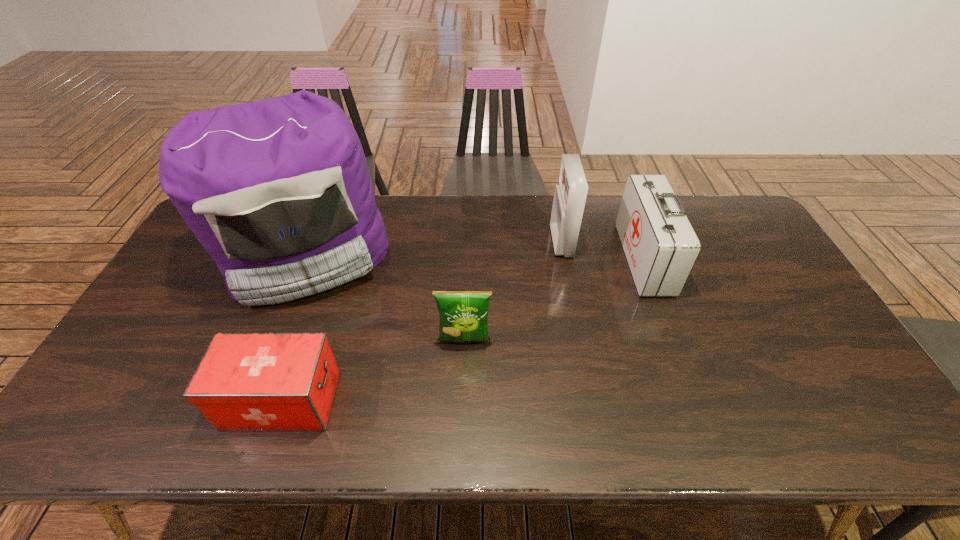
Image resolution: width=960 pixels, height=540 pixels. What are the coordinates of `vacant space located 0.080m on the front-facing side of the second tallest object` in the screenshot? It's located at (528, 242).

Where is `vacant space located on the front-facing side of the second tallest object`? This screenshot has width=960, height=540. vacant space located on the front-facing side of the second tallest object is located at coordinates [448, 242].

This screenshot has height=540, width=960. In order to click on free region located 0.170m on the front-facing side of the second tallest object in this screenshot , I will do `click(500, 242)`.

Where is `vacant area situated 0.300m on the front-facing side of the rightmost object`? This screenshot has height=540, width=960. vacant area situated 0.300m on the front-facing side of the rightmost object is located at coordinates (531, 259).

This screenshot has height=540, width=960. I want to click on vacant space situated on the front-facing side of the rightmost object, so click(x=502, y=259).

The height and width of the screenshot is (540, 960). What are the coordinates of `free space located on the front-facing side of the rightmost object` in the screenshot? It's located at (598, 259).

Image resolution: width=960 pixels, height=540 pixels. Find the location of `free space located 0.240m on the front-facing side of the crisp (potato chip)`. free space located 0.240m on the front-facing side of the crisp (potato chip) is located at coordinates (462, 438).

You are a GUI agent. You are given a task and a screenshot of the screen. Output one action in this format:
    pyautogui.click(x=<x>, y=<y>)
    Task: Click on the vacant space situated on the handle side of the leftmost first-aid kit
    This screenshot has height=540, width=960.
    Given the screenshot: What is the action you would take?
    pyautogui.click(x=463, y=400)

Find the location of a particular element. The width and height of the screenshot is (960, 540). backpack present at the far edge is located at coordinates (278, 192).

What are the coordinates of `object located at the near edge` in the screenshot? It's located at (246, 381).